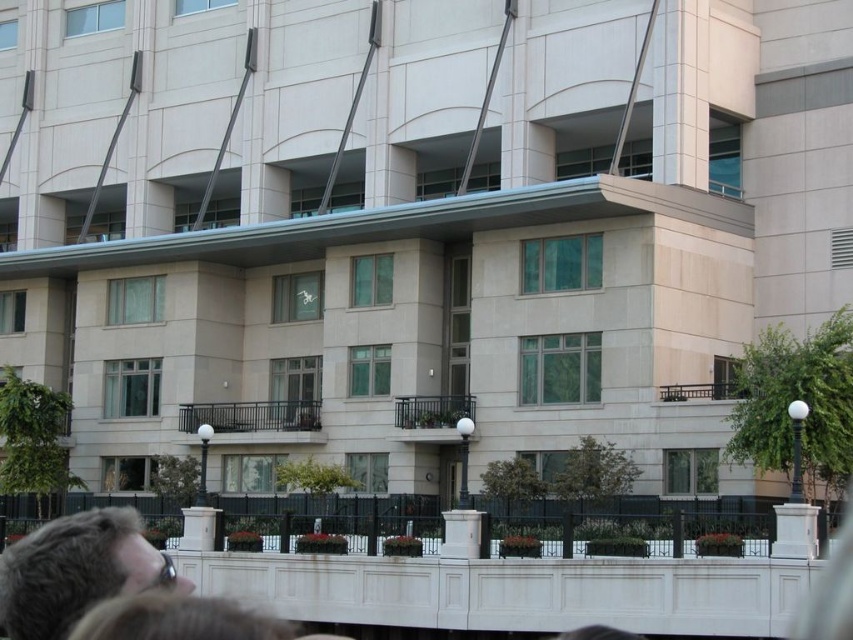
You are standing in front of the building and want to determine the distance between two points on the facade. The first point is labeled as point (41, 563) and the second is point (71, 632). Based on their positions, which point is closer to you?

Point (41, 563) is closer to you because it is further to the viewer than point (71, 632).

From the picture: You are standing at a point 58.22 feet away from the point labeled as point [50,595] on the building facade. If you want to take a photo of the building, would you need to move closer or farther away to ensure the entire structure fits within your camera frame?

Since you are currently 58.22 feet away from point [50,595] on the building facade, you would need to move farther away to ensure the entire structure fits within your camera frame.